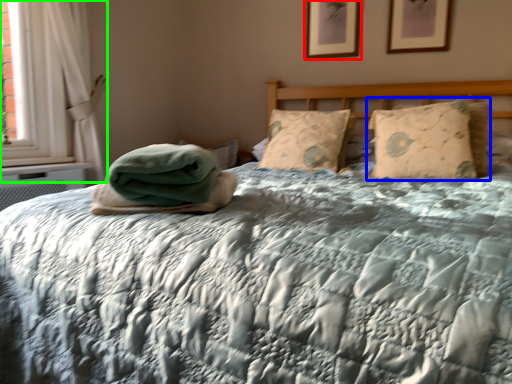
Question: Which object is the farthest from picture frame (highlighted by a red box)? Choose among these: pillow (highlighted by a blue box) or curtain (highlighted by a green box).

Choices:
 (A) pillow
 (B) curtain

Answer: (B)